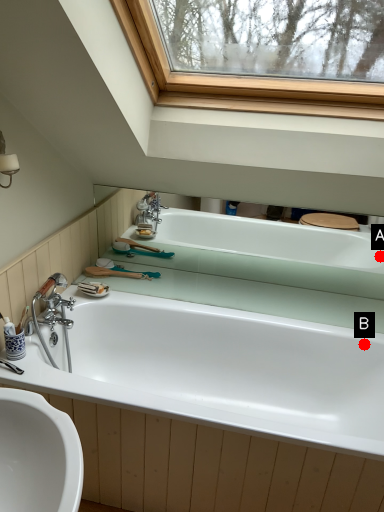
Question: Two points are circled on the image, labeled by A and B beside each circle. Which point appears farthest from the camera in this image?

Choices:
 (A) A is further
 (B) B is further

Answer: (A)